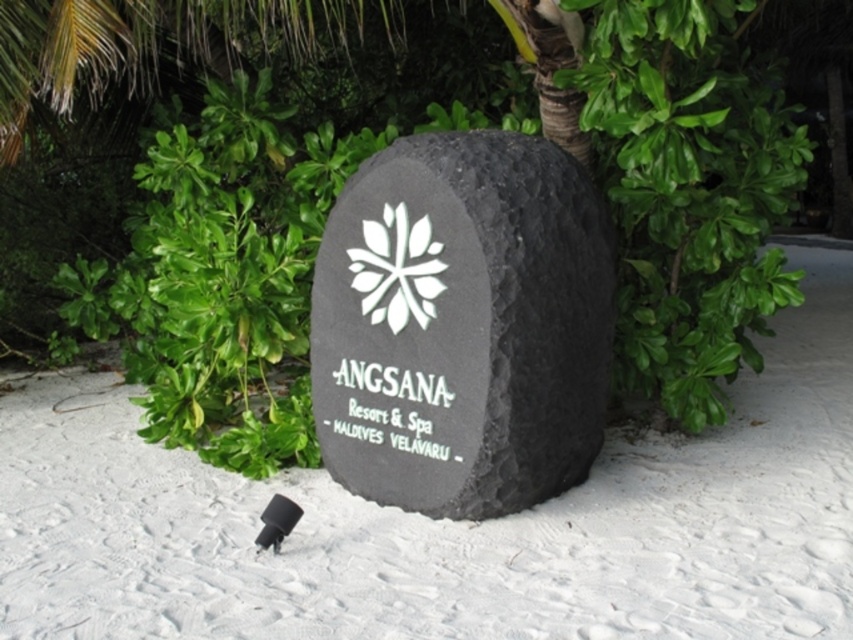
Question: Estimate the real-world distances between objects in this image. Which object is farther from the white sand at center?

Choices:
 (A) black stone sign at center
 (B) green leafy tree at center

Answer: (B)

Question: Estimate the real-world distances between objects in this image. Which object is farther from the black stone sign at center?

Choices:
 (A) green leafy tree at center
 (B) white sand at center

Answer: (A)

Question: Does green leafy tree at center appear on the right side of white sand at center?

Choices:
 (A) no
 (B) yes

Answer: (A)

Question: Is green leafy tree at center bigger than black stone sign at center?

Choices:
 (A) no
 (B) yes

Answer: (B)

Question: Among these points, which one is farthest from the camera?

Choices:
 (A) (430, 531)
 (B) (554, 460)

Answer: (B)

Question: Does white sand at center have a smaller size compared to black stone sign at center?

Choices:
 (A) yes
 (B) no

Answer: (B)